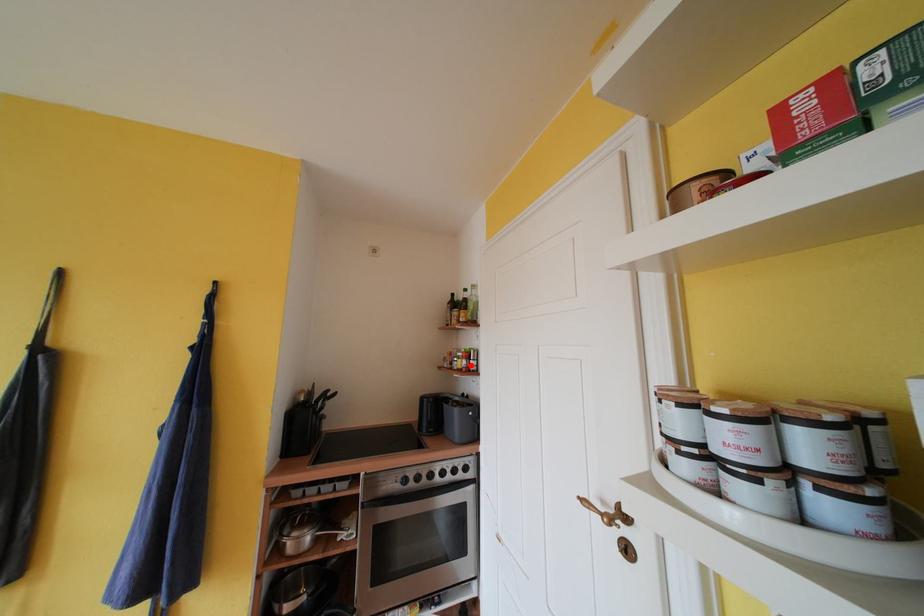
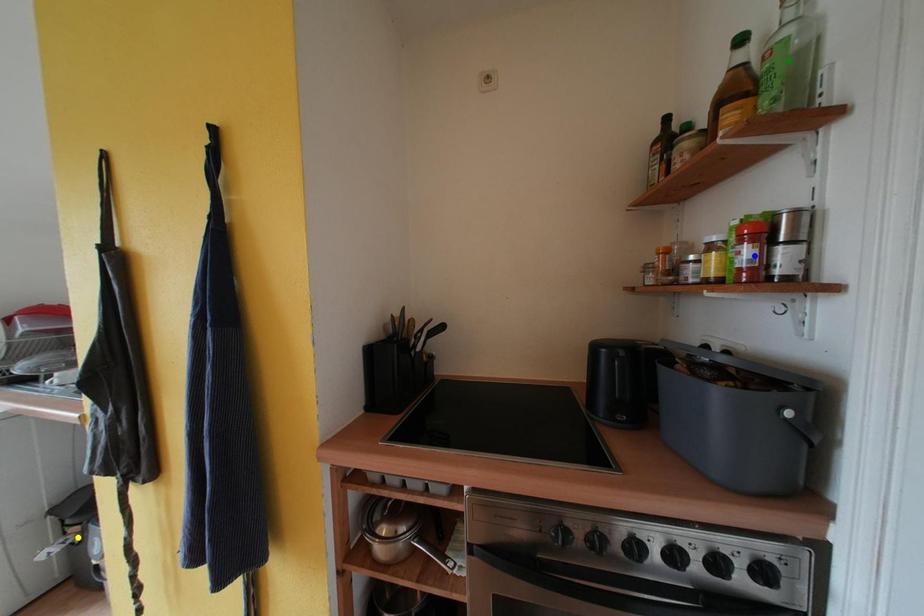
Question: I am providing you with two images of the same scene from different viewpoints. A red point is marked on the first image. You are given multiple points on the second image. Which spot in image 2 lines up with the point in image 1?

Choices:
 (A) blue point
 (B) yellow point
 (C) green point

Answer: (A)